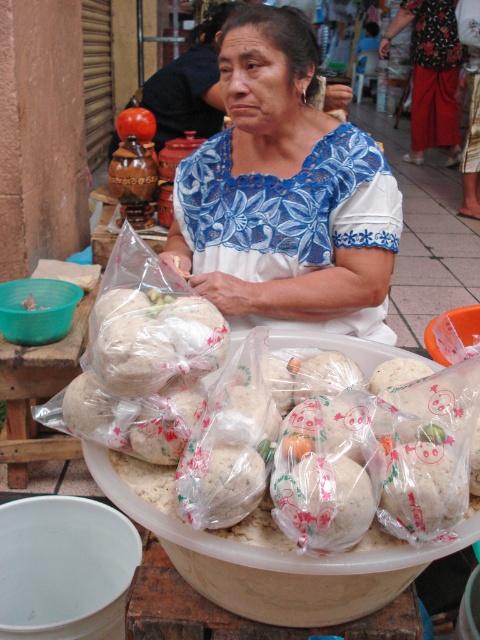
Question: Which point is farther from the camera taking this photo?

Choices:
 (A) (70, 390)
 (B) (55, 323)
 (C) (184, 205)

Answer: (B)

Question: In this image, where is white lace blouse at center located relative to translucent plastic bagged bread at center?

Choices:
 (A) left
 (B) right

Answer: (B)

Question: Which object is positioned farthest from the translucent plastic table at lower left?

Choices:
 (A) white lace blouse at center
 (B) translucent plastic bowl at lower left
 (C) floral fabric skirt at lower right
 (D) translucent plastic bagged bread at center

Answer: (C)

Question: Is translucent plastic table at lower left thinner than translucent plastic bowl at lower left?

Choices:
 (A) yes
 (B) no

Answer: (B)

Question: Which point appears closest to the camera in this image?

Choices:
 (A) (9, 406)
 (B) (68, 301)

Answer: (A)

Question: Does translucent plastic table at lower left appear on the left side of translucent plastic bowl at lower left?

Choices:
 (A) yes
 (B) no

Answer: (B)